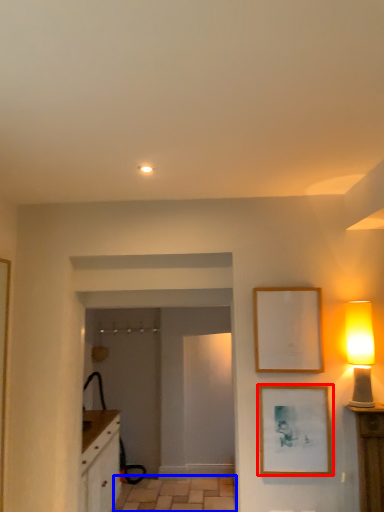
Question: Which object appears farthest to the camera in this image, picture frame (highlighted by a red box) or tile (highlighted by a blue box)?

Choices:
 (A) picture frame
 (B) tile

Answer: (B)